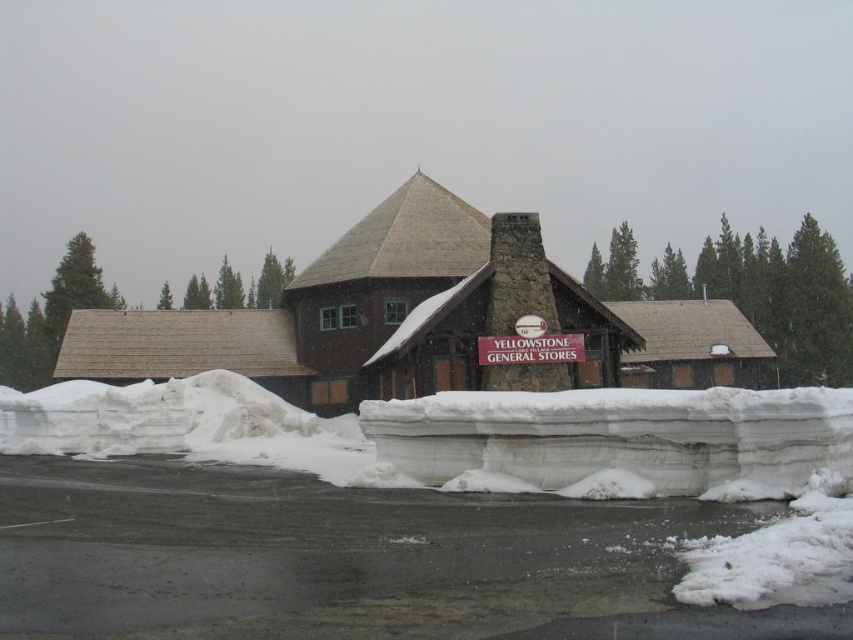
You are a delivery person trying to reach the Yellowstone General Stores at center. There is a white snowdrift at lower center in your path. Can you walk over it without needing to clear the snow?

The white snowdrift at lower center is not as tall as the Yellowstone General Stores at center, so it is shorter than the building. However, without knowing the exact height of the snowdrift relative to a person, it is uncertain if you can walk over it without clearing the snow.

You are a delivery person trying to reach the Yellowstone General Stores at center. There is a white snowdrift at lower center in your path. Can you walk around it easily?

The white snowdrift at lower center is smaller than the Yellowstone General Stores at center, so it is possible to walk around it easily.

You are standing in front of the Yellowstone General Stores building and want to walk towards the two points marked on the ground. Which point, point (537, 412) or point (480, 358), will you reach first?

You will reach point (537, 412) first because it is closer to you than point 0.562, 0.634.